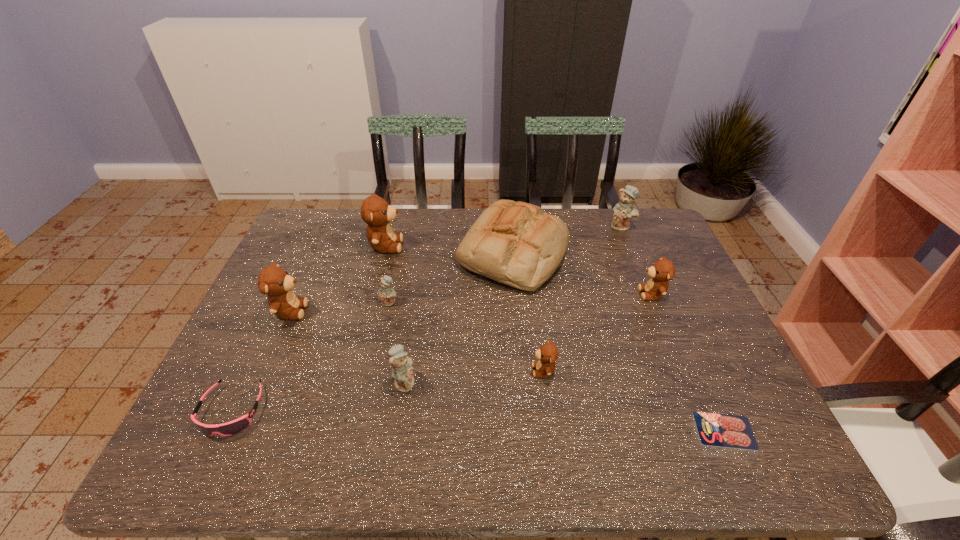
Image resolution: width=960 pixels, height=540 pixels. What are the coordinates of `vacant space at the near edge of the desktop` in the screenshot? It's located at (328, 459).

I want to click on vacant space at the right edge, so click(646, 274).

This screenshot has height=540, width=960. Find the location of `free space at the far left corner`. free space at the far left corner is located at coordinates (319, 241).

At what (x,y) coordinates should I click in order to perform the action: click on vacant space at the far right corner of the desktop. Please return your answer as a coordinate pair (x, y). This screenshot has width=960, height=540. Looking at the image, I should click on (648, 233).

At what (x,y) coordinates should I click in order to perform the action: click on vacant area between the pink goggles and the bread. Please return your answer as a coordinate pair (x, y). The width and height of the screenshot is (960, 540). Looking at the image, I should click on (372, 332).

Locate an element on the screen. This screenshot has height=540, width=960. free space that is in between the bread and the leftmost blue teddy bear is located at coordinates (451, 278).

What are the coordinates of `unoccupied position between the third brown teddy bear from left to right and the shortest object` in the screenshot? It's located at (635, 401).

Locate an element on the screen. The width and height of the screenshot is (960, 540). unoccupied position between the salami and the rightmost brown teddy bear is located at coordinates (688, 362).

The image size is (960, 540). Identify the location of free space between the nearest blue teddy bear and the leftmost brown teddy bear. (348, 346).

What are the coordinates of `free space that is in between the leftmost brown teddy bear and the bread` in the screenshot? It's located at (401, 282).